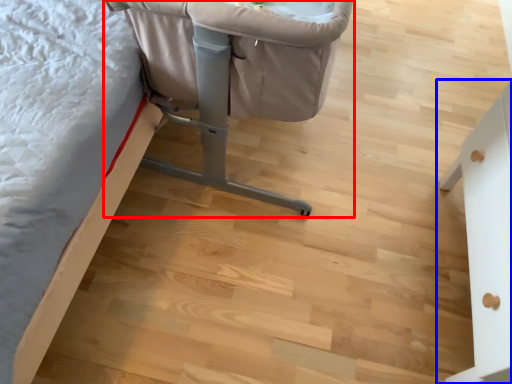
Question: Among these objects, which one is nearest to the camera, furniture (highlighted by a red box) or furniture (highlighted by a blue box)?

Choices:
 (A) furniture
 (B) furniture

Answer: (B)